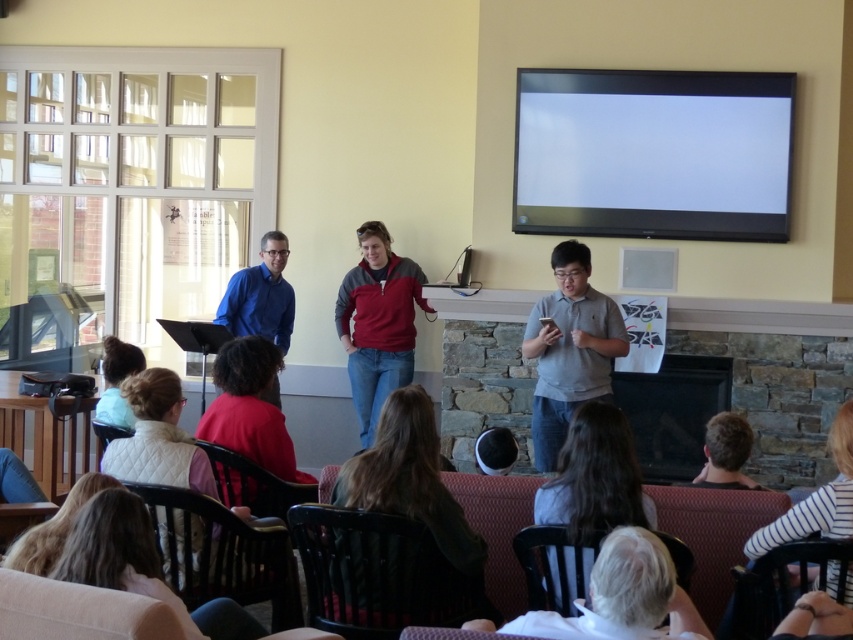
In the scene shown: Between light brown hair at lower center and blue shirt at center, which one is positioned lower?

Positioned lower is light brown hair at lower center.

Can you confirm if light brown hair at lower center is smaller than blue shirt at center?

Indeed, light brown hair at lower center has a smaller size compared to blue shirt at center.

In the scene shown: Measure the distance between light brown hair at lower center and camera.

light brown hair at lower center and camera are 3.09 meters apart.

Where is `light brown hair at lower center`? light brown hair at lower center is located at coordinates (595, 477).

Can you confirm if gray cotton shirt at center is positioned to the left of light brown hair at lower center?

Incorrect, gray cotton shirt at center is not on the left side of light brown hair at lower center.

Can you confirm if gray cotton shirt at center is shorter than light brown hair at lower center?

No, gray cotton shirt at center is not shorter than light brown hair at lower center.

Is point (625, 339) closer to camera compared to point (564, 442)?

No.

I want to click on gray cotton shirt at center, so click(x=569, y=349).

Is white fabric at lower center thinner than blonde hair at lower left?

Incorrect, white fabric at lower center's width is not less than blonde hair at lower left's.

Between white fabric at lower center and blonde hair at lower left, which one is positioned higher?

blonde hair at lower left

Is point (634, 596) closer to camera compared to point (120, 358)?

That is True.

Find the location of a particular element. This screenshot has width=853, height=640. white fabric at lower center is located at coordinates (624, 596).